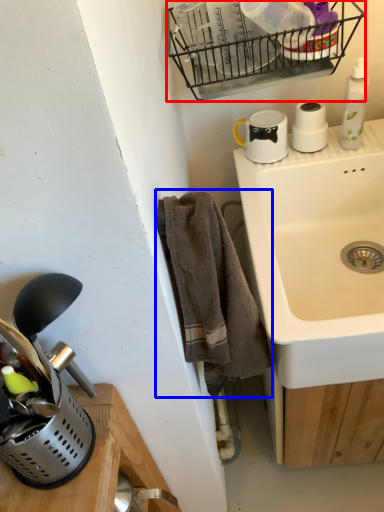
Question: Among these objects, which one is nearest to the camera, basket (highlighted by a red box) or bath towel (highlighted by a blue box)?

Choices:
 (A) basket
 (B) bath towel

Answer: (B)